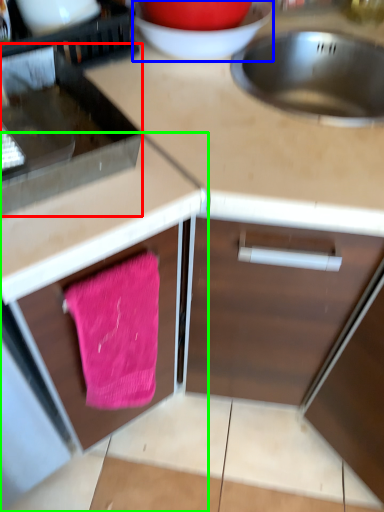
Question: Considering the real-world distances, which object is farthest from appliance (highlighted by a red box)? basin (highlighted by a blue box) or cabinetry (highlighted by a green box)?

Choices:
 (A) basin
 (B) cabinetry

Answer: (A)